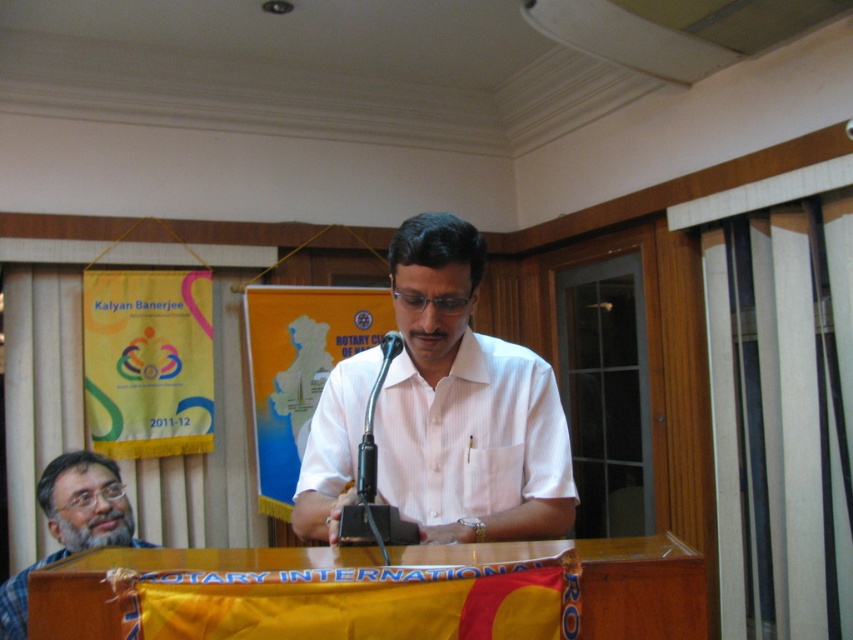
Between gray checkered shirt at lower left and black plastic microphone at center, which one is positioned higher?

black plastic microphone at center is higher up.

Does point (12, 612) lie behind point (408, 532)?

Yes, point (12, 612) is farther from viewer.

This screenshot has width=853, height=640. What are the coordinates of `gray checkered shirt at lower left` in the screenshot? It's located at (73, 524).

I want to click on white striped shirt at center, so click(465, 404).

Is white striped shirt at center bigger than gray checkered shirt at lower left?

No.

Is point (312, 433) positioned behind point (80, 512)?

No.

You are a GUI agent. You are given a task and a screenshot of the screen. Output one action in this format:
    pyautogui.click(x=<x>, y=<y>)
    Task: Click on the white striped shirt at center
    
    Given the screenshot: What is the action you would take?
    pyautogui.click(x=465, y=404)

Is the position of white striped shirt at center more distant than that of black plastic microphone at center?

Yes, it is.

Who is higher up, white striped shirt at center or black plastic microphone at center?

white striped shirt at center is above.

Who is more distant from viewer, (408, 257) or (405, 524)?

Point (408, 257)

I want to click on white striped shirt at center, so click(x=465, y=404).